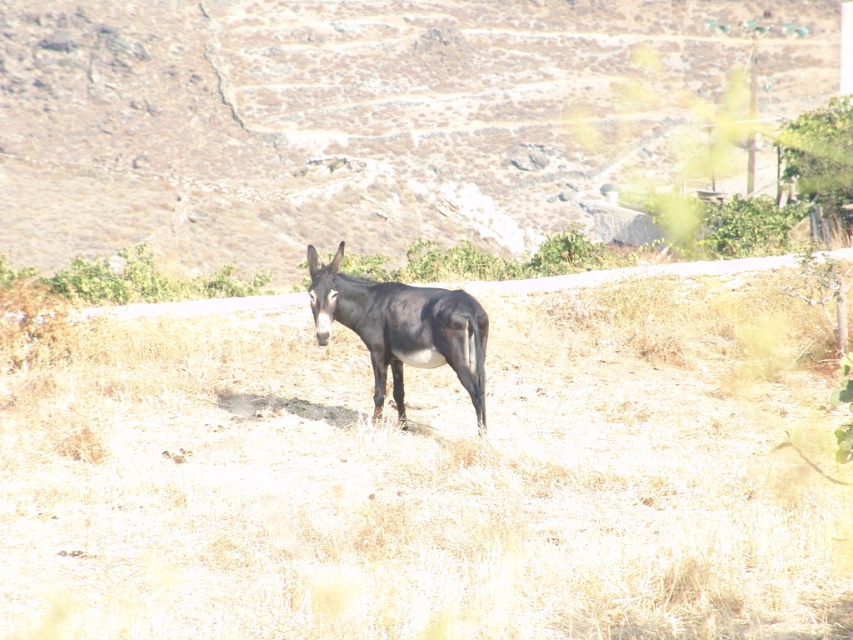
Question: Is dry grass at center to the right of dark brown fur at center from the viewer's perspective?

Choices:
 (A) no
 (B) yes

Answer: (B)

Question: Which object is positioned farthest from the brown rough donkey at center?

Choices:
 (A) dark brown fur at center
 (B) dry grass at center

Answer: (A)

Question: Which point is closer to the camera?

Choices:
 (A) (450, 326)
 (B) (4, 452)
 (C) (16, 4)

Answer: (A)

Question: Can you confirm if dry grass at center is positioned below brown rough donkey at center?

Choices:
 (A) yes
 (B) no

Answer: (A)

Question: Can you confirm if dry grass at center is wider than dark brown fur at center?

Choices:
 (A) no
 (B) yes

Answer: (B)

Question: Which object is the farthest from the dry grass at center?

Choices:
 (A) brown rough donkey at center
 (B) dark brown fur at center

Answer: (A)